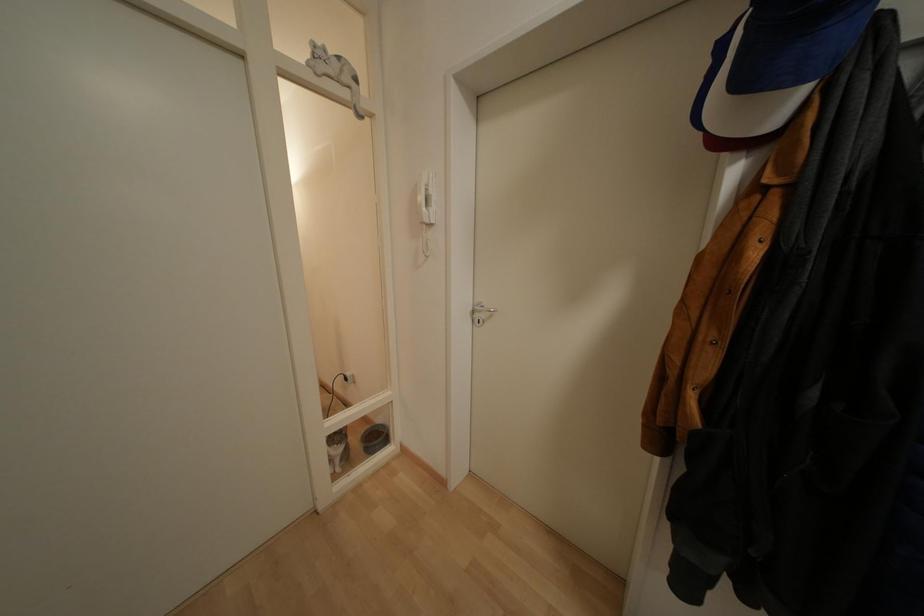
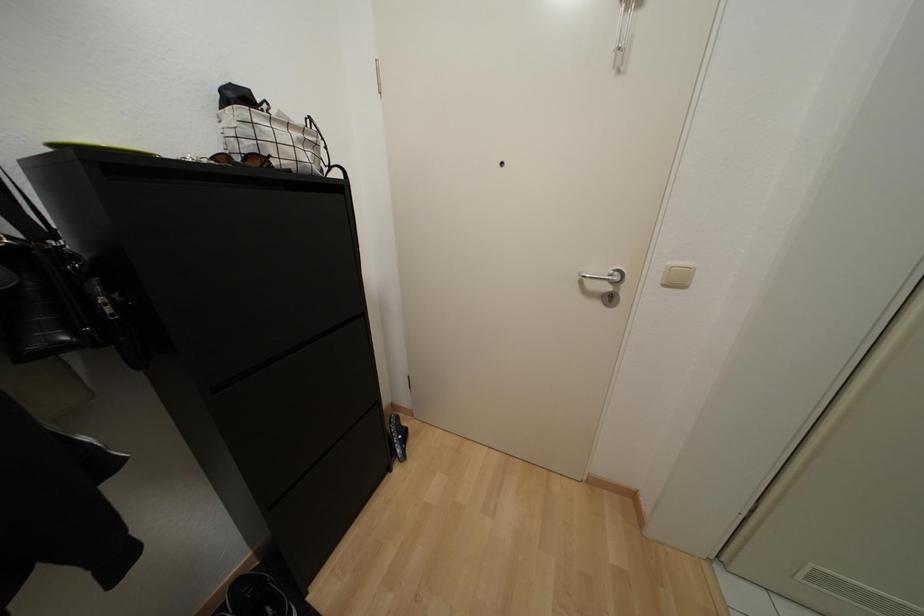
How did the camera likely rotate?

The rotation direction of the camera is right-down.